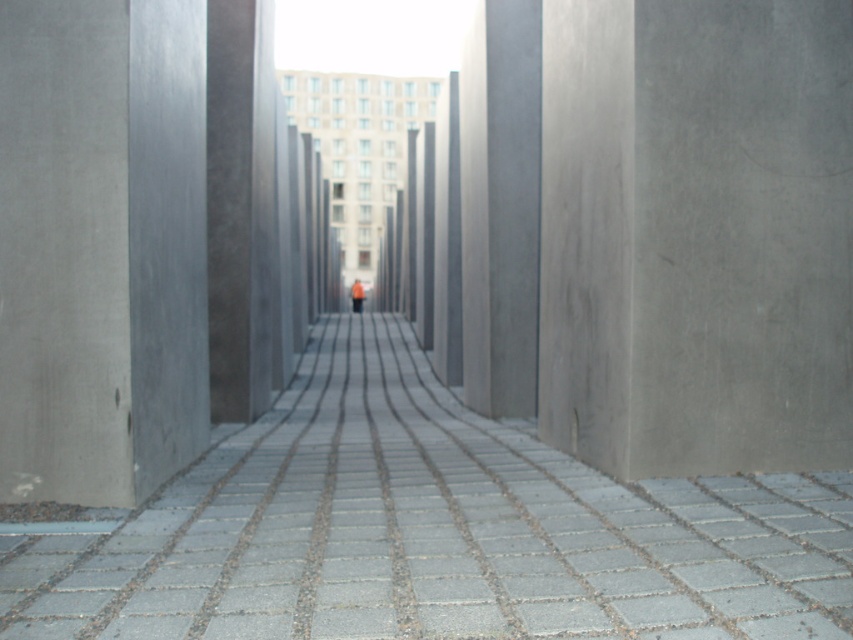
Is gray concrete pavement at center to the right of orange fabric person at center from the viewer's perspective?

Yes, gray concrete pavement at center is to the right of orange fabric person at center.

Who is more distant from viewer, (x=45, y=566) or (x=350, y=294)?

The point (x=350, y=294) is behind.

Identify the location of gray concrete pavement at center. Image resolution: width=853 pixels, height=640 pixels. (433, 531).